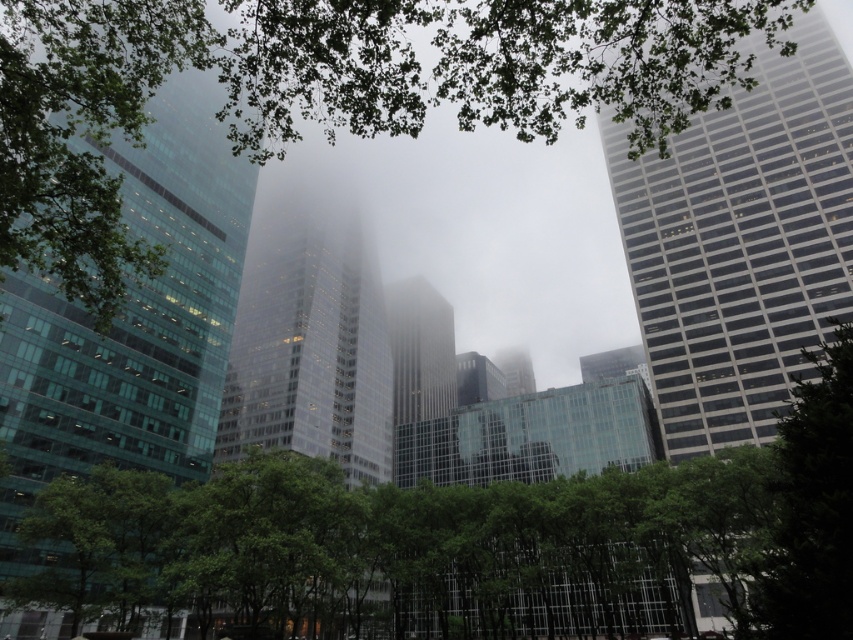
The image size is (853, 640). What are the coordinates of `green leafy tree at lower left` in the screenshot? It's located at (402, 547).

Is green leafy tree at lower left thinner than green leafy tree at right?

Incorrect, green leafy tree at lower left's width is not less than green leafy tree at right's.

Between point (71, 593) and point (780, 522), which one is positioned in front?

Point (780, 522)

Where is `green leafy tree at lower left`? The width and height of the screenshot is (853, 640). green leafy tree at lower left is located at coordinates (402, 547).

Is green leafy tree at upper center positioned at the back of green leafy tree at lower left?

No, green leafy tree at upper center is closer to the viewer.

Which is below, green leafy tree at upper center or green leafy tree at lower left?

green leafy tree at lower left is below.

Is point (49, 163) farther from camera compared to point (625, 492)?

That is False.

The height and width of the screenshot is (640, 853). I want to click on green leafy tree at upper center, so click(329, 90).

Looking at this image, does green leafy tree at upper center appear on the left side of green leafy tree at right?

Yes, green leafy tree at upper center is to the left of green leafy tree at right.

Is point (131, 65) positioned before point (770, 577)?

No, it is not.

At what (x,y) coordinates should I click in order to perform the action: click on green leafy tree at upper center. Please return your answer as a coordinate pair (x, y). Looking at the image, I should click on (329, 90).